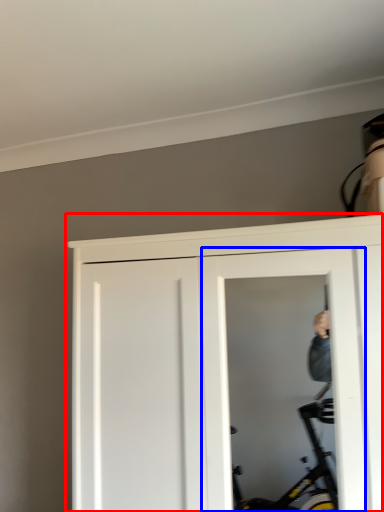
Question: Which object is further to the camera taking this photo, door (highlighted by a red box) or screen door (highlighted by a blue box)?

Choices:
 (A) door
 (B) screen door

Answer: (B)